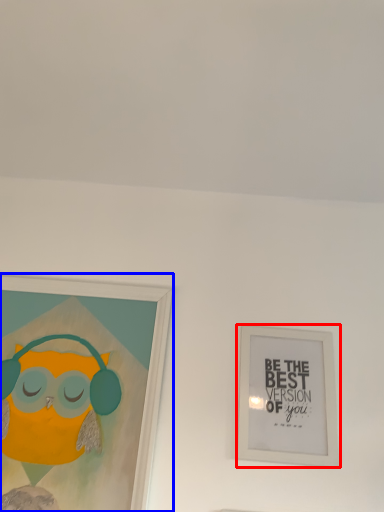
Question: Among these objects, which one is nearest to the camera, picture frame (highlighted by a red box) or picture frame (highlighted by a blue box)?

Choices:
 (A) picture frame
 (B) picture frame

Answer: (B)